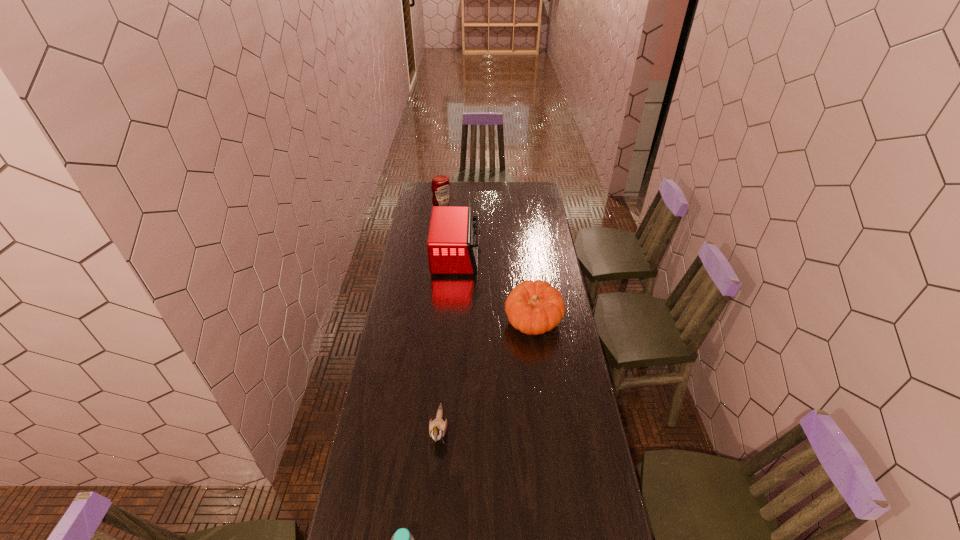
Find the location of `vacant area that lies between the third farthest object and the toaster oven`. vacant area that lies between the third farthest object and the toaster oven is located at coordinates (494, 289).

You are a GUI agent. You are given a task and a screenshot of the screen. Output one action in this format:
    pyautogui.click(x=<x>, y=<y>)
    Task: Click on the third closest object relative to the fourth farthest object
    The height and width of the screenshot is (540, 960).
    Given the screenshot: What is the action you would take?
    pyautogui.click(x=452, y=245)

Image resolution: width=960 pixels, height=540 pixels. In order to click on object identified as the third closest to the farthest object in this screenshot , I will do `click(437, 428)`.

Locate an element on the screen. vacant region that satisfies the following two spatial constraints: 1. on the front-facing side of the fourth nearest object; 2. on the right side of the rightmost object is located at coordinates (452, 322).

Where is `free location that satisfies the following two spatial constraints: 1. on the front-facing side of the toaster oven; 2. on the back side of the third nearest object`? free location that satisfies the following two spatial constraints: 1. on the front-facing side of the toaster oven; 2. on the back side of the third nearest object is located at coordinates (452, 322).

You are a GUI agent. You are given a task and a screenshot of the screen. Output one action in this format:
    pyautogui.click(x=<x>, y=<y>)
    Task: Click on the free space that satisfies the following two spatial constraints: 1. on the front-facing side of the second farthest object; 2. on the back side of the rightmost object
    The height and width of the screenshot is (540, 960).
    Given the screenshot: What is the action you would take?
    pyautogui.click(x=452, y=322)

Where is `vacant region that satisfies the following two spatial constraints: 1. on the front-facing side of the second farthest object; 2. at the face of the bird`? vacant region that satisfies the following two spatial constraints: 1. on the front-facing side of the second farthest object; 2. at the face of the bird is located at coordinates tap(445, 429).

At what (x,y) coordinates should I click in order to perform the action: click on vacant space that satisfies the following two spatial constraints: 1. on the front-facing side of the fourth nearest object; 2. at the face of the second nearest object. Please return your answer as a coordinate pair (x, y). Image resolution: width=960 pixels, height=540 pixels. Looking at the image, I should click on (445, 429).